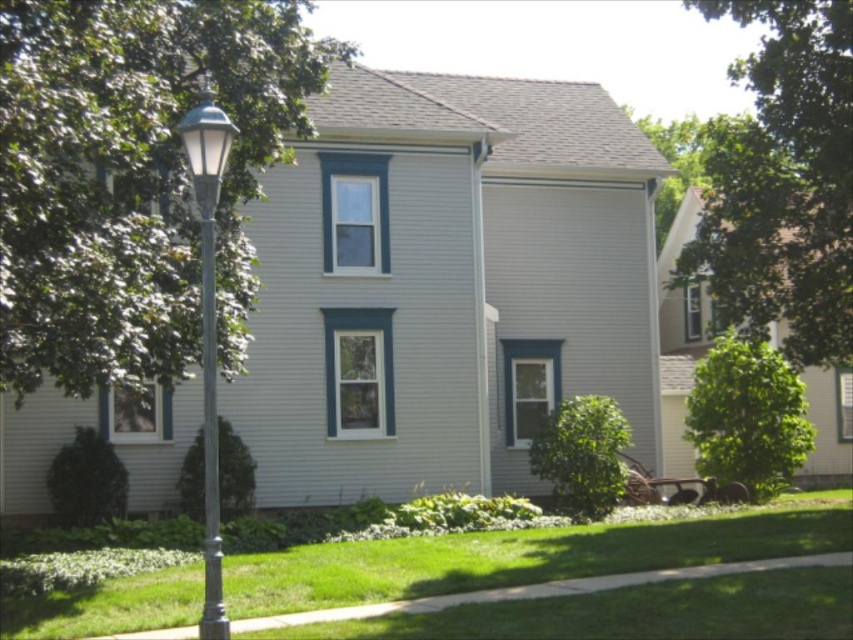
Between point (93, 600) and point (207, 552), which one is positioned behind?

Point (93, 600)

Does green grass at lower center appear under metallic gray pole at left?

Yes.

Which is behind, point (822, 509) or point (215, 634)?

Point (822, 509)

At what (x,y) coordinates should I click in order to perform the action: click on green grass at lower center. Please return your answer as a coordinate pair (x, y). Looking at the image, I should click on (521, 556).

Is green leafy tree at right positioned before green leafy bush at lower left?

No, it is not.

Can you confirm if green leafy tree at right is smaller than green leafy bush at lower left?

Actually, green leafy tree at right might be larger than green leafy bush at lower left.

Is point (715, 480) positioned in front of point (94, 468)?

No, it is behind (94, 468).

Where is `green leafy tree at right`? green leafy tree at right is located at coordinates (747, 417).

Does green leafy tree at right have a lesser width compared to green leafy bush at lower center?

In fact, green leafy tree at right might be wider than green leafy bush at lower center.

The width and height of the screenshot is (853, 640). I want to click on green leafy tree at right, so click(747, 417).

Which is behind, point (808, 448) or point (556, 472)?

The point (808, 448) is more distant.

You are a GUI agent. You are given a task and a screenshot of the screen. Output one action in this format:
    pyautogui.click(x=<x>, y=<y>)
    Task: Click on the green leafy tree at right
    This screenshot has height=640, width=853.
    Given the screenshot: What is the action you would take?
    pyautogui.click(x=747, y=417)